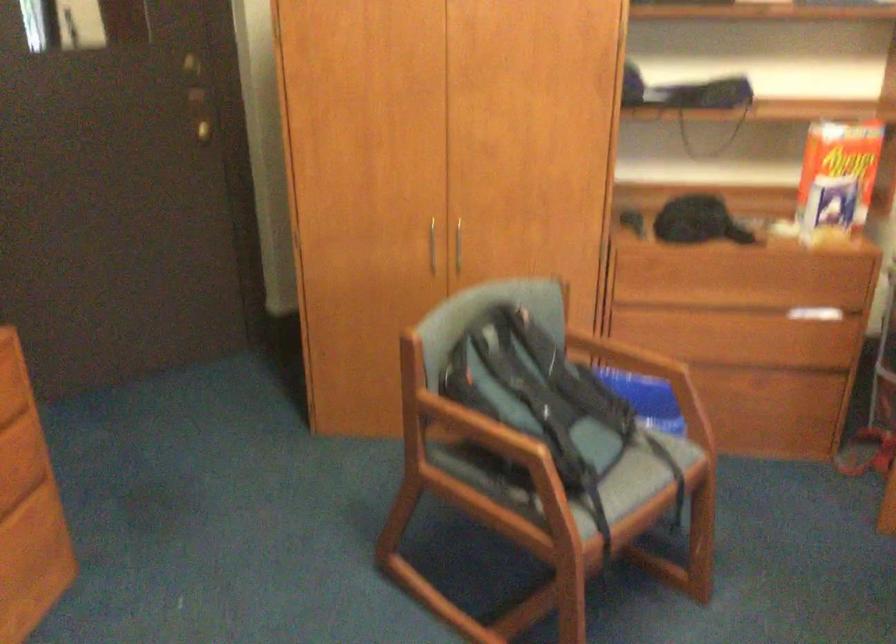
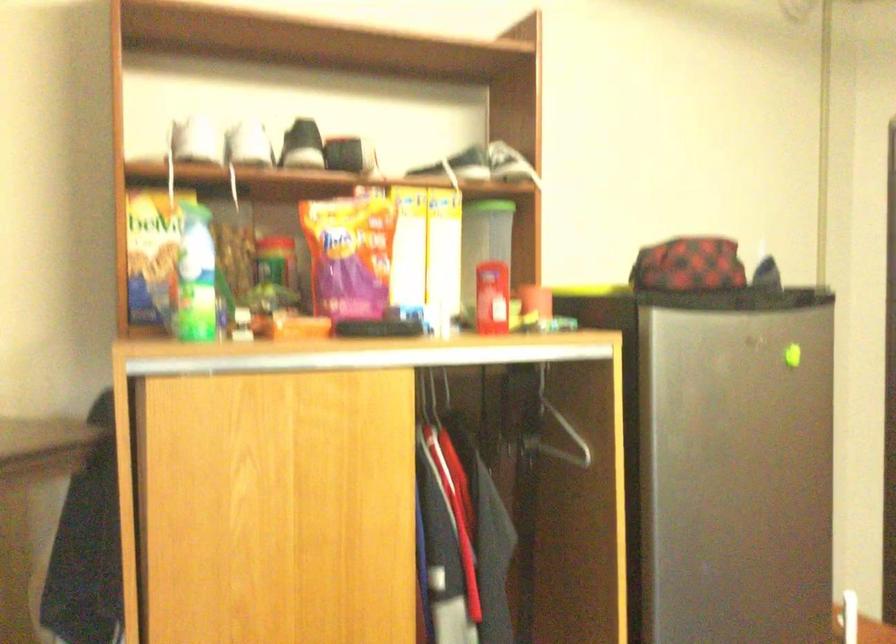
Question: Based on the continuous images, in which direction is the camera rotating? Reply with the corresponding letter.

Choices:
 (A) Left
 (B) Right
 (C) Up
 (D) Down

Answer: (A)